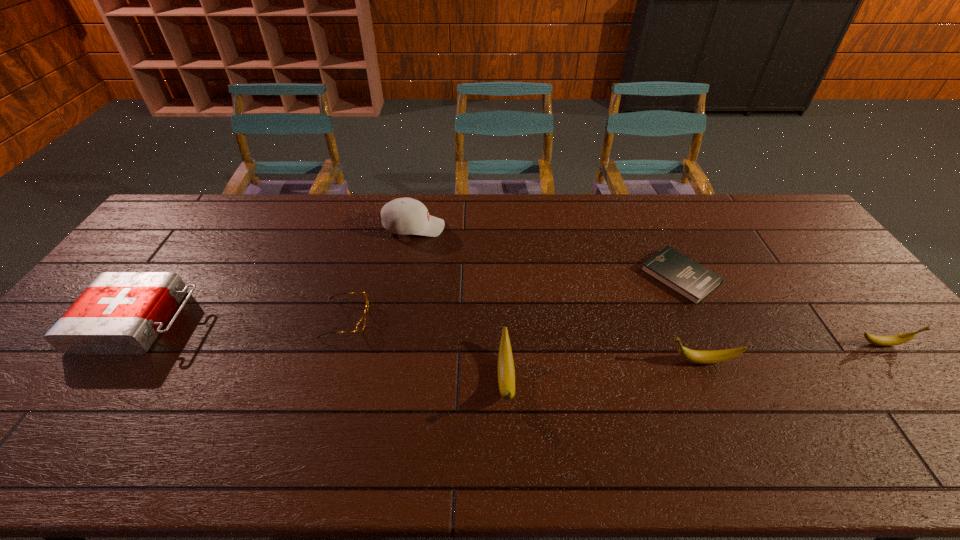
Identify the location of blank space located at the stem of the second banana from left to right. This screenshot has height=540, width=960. (574, 361).

This screenshot has width=960, height=540. I want to click on free space located at the stem of the second banana from left to right, so click(x=539, y=361).

Where is `vacant region located on the right of the shortest object`? This screenshot has width=960, height=540. vacant region located on the right of the shortest object is located at coordinates pyautogui.click(x=806, y=277).

This screenshot has height=540, width=960. I want to click on vacant region located on the front-facing side of the baseball cap, so click(468, 227).

Locate an element on the screen. Image resolution: width=960 pixels, height=540 pixels. vacant space positioned 0.050m on the front side of the leftmost object is located at coordinates (210, 321).

The width and height of the screenshot is (960, 540). In order to click on free space located 0.350m on the front-facing side of the spectacles in this screenshot , I will do `click(494, 319)`.

At what (x,y) coordinates should I click in order to perform the action: click on object positioned at the far edge. Please return your answer as a coordinate pair (x, y). Looking at the image, I should click on (404, 216).

This screenshot has height=540, width=960. In order to click on object located in the near edge section of the desktop in this screenshot , I will do `click(506, 374)`.

Image resolution: width=960 pixels, height=540 pixels. What are the coordinates of `object at the left edge` in the screenshot? It's located at (119, 312).

What are the coordinates of `object at the right edge` in the screenshot? It's located at (893, 340).